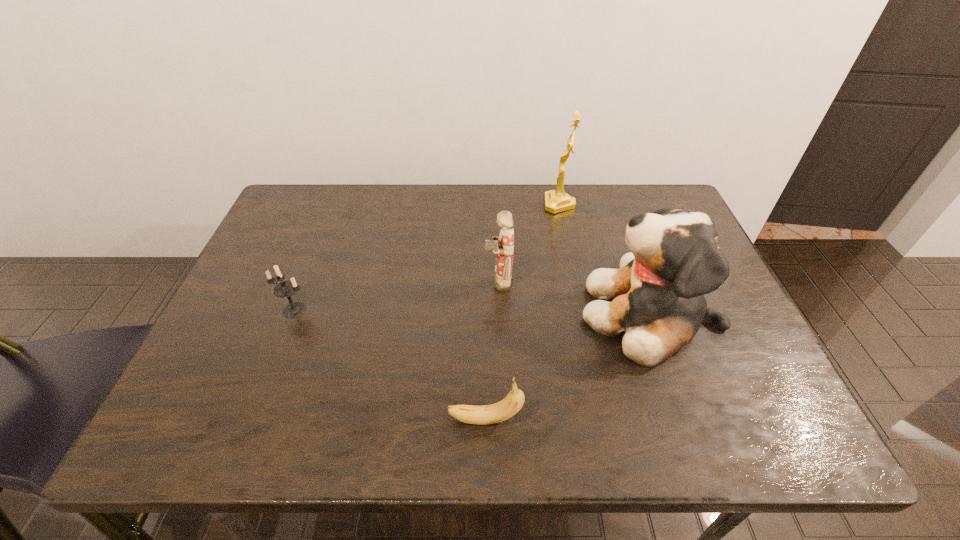
Find the location of `the farthest object`. the farthest object is located at coordinates (556, 201).

You are a GUI agent. You are given a task and a screenshot of the screen. Output one action in this format:
    pyautogui.click(x=<x>, y=<y>)
    Task: Click on the puppy
    Image resolution: width=960 pixels, height=540 pixels.
    Given the screenshot: What is the action you would take?
    pyautogui.click(x=658, y=291)

The image size is (960, 540). I want to click on figurine, so click(x=503, y=246).

In order to click on the leftmost object in this screenshot , I will do `click(285, 289)`.

Locate an element on the screen. the nearest object is located at coordinates (487, 414).

The width and height of the screenshot is (960, 540). Find the location of `vacant region located on the front-facing side of the award`. vacant region located on the front-facing side of the award is located at coordinates (508, 204).

Where is `free space located on the front-facing side of the award`? The height and width of the screenshot is (540, 960). free space located on the front-facing side of the award is located at coordinates (438, 204).

At what (x,y) coordinates should I click in order to perform the action: click on free space located 0.240m on the front-facing side of the award. Please return your answer as a coordinate pair (x, y). The height and width of the screenshot is (540, 960). Looking at the image, I should click on (467, 204).

What are the coordinates of `vacant space located 0.180m at the face of the puppy` in the screenshot? It's located at (505, 314).

What are the coordinates of `free space located at the face of the puppy` in the screenshot? It's located at (510, 314).